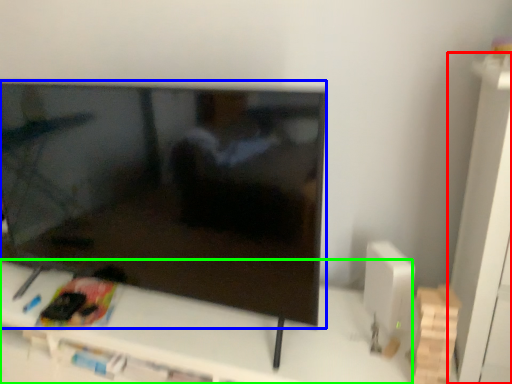
Question: Which object is positioned closest to tv cabinet (highlighted by a red box)? Select from television (highlighted by a blue box) and furniture (highlighted by a green box).

Choices:
 (A) television
 (B) furniture

Answer: (B)